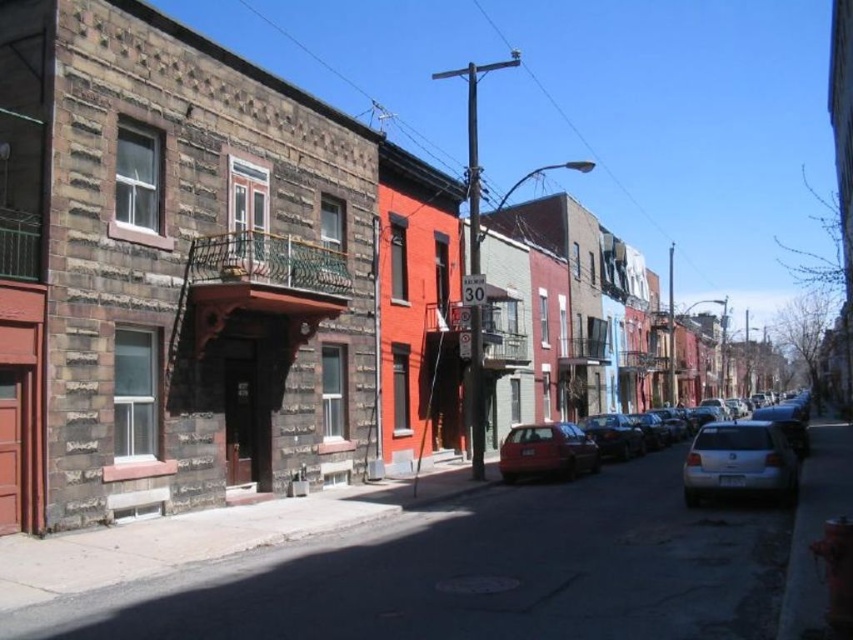
Between matte silver sedan at center and matte red car at center, which one is positioned lower?

matte silver sedan at center is below.

This screenshot has height=640, width=853. What are the coordinates of `matte silver sedan at center` in the screenshot? It's located at (750, 444).

At what (x,y) coordinates should I click in order to perform the action: click on matte silver sedan at center. Please return your answer as a coordinate pair (x, y). Image resolution: width=853 pixels, height=640 pixels. Looking at the image, I should click on (750, 444).

Measure the distance between point (717,404) and camera.

Point (717,404) is 49.45 meters from camera.

Between matte silver sedan at center and silver metallic sedan at lower right, which one appears on the right side from the viewer's perspective?

Positioned to the right is matte silver sedan at center.

Identify the location of matte silver sedan at center. (750, 444).

Locate an element on the screen. The image size is (853, 640). matte silver sedan at center is located at coordinates (750, 444).

In the scene shown: Between silver metallic sedan at lower right and shiny black sedan at center, which one appears on the left side from the viewer's perspective?

From the viewer's perspective, shiny black sedan at center appears more on the left side.

Can you confirm if silver metallic sedan at lower right is smaller than shiny black sedan at center?

No, silver metallic sedan at lower right is not smaller than shiny black sedan at center.

Find the location of a particular element. silver metallic sedan at lower right is located at coordinates (740, 461).

Where is `silver metallic sedan at lower right`? The width and height of the screenshot is (853, 640). silver metallic sedan at lower right is located at coordinates (740, 461).